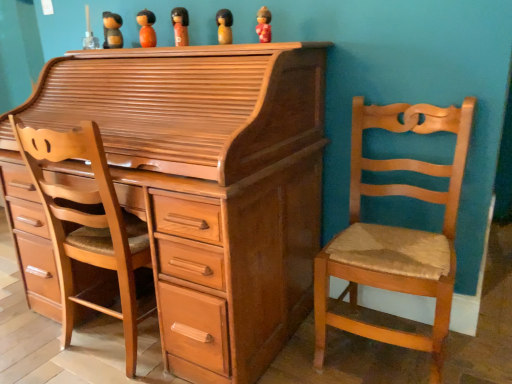
Where is `free space in front of matte orange doll at center, the 3th toy from the left`? This screenshot has height=384, width=512. free space in front of matte orange doll at center, the 3th toy from the left is located at coordinates (183, 46).